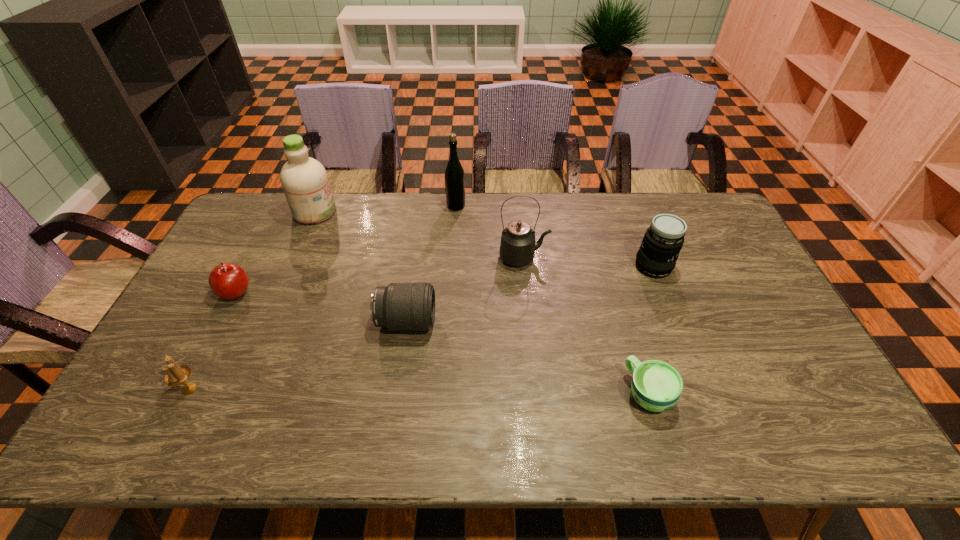
Find the location of a particular element. Image resolution: width=960 pixels, height=540 pixels. vacant point located between the second object from right to left and the apple is located at coordinates (442, 343).

This screenshot has width=960, height=540. Find the location of `object that stands as the fourth closest to the seventh object from left to right`. object that stands as the fourth closest to the seventh object from left to right is located at coordinates (454, 176).

Find the location of a particular element. object that can be found as the sixth closest to the third object from right to left is located at coordinates (227, 281).

The image size is (960, 540). I want to click on blank space that satisfies the following two spatial constraints: 1. on the surface of the cup; 2. on the left side of the fifth object from right to left, so click(x=396, y=393).

Locate an element on the screen. The width and height of the screenshot is (960, 540). vacant space that satisfies the following two spatial constraints: 1. on the back side of the seventh object from left to right; 2. on the surface of the shorter telephoto lens is located at coordinates (627, 322).

You are a GUI agent. You are given a task and a screenshot of the screen. Output one action in this format:
    pyautogui.click(x=<x>, y=<y>)
    Task: Click on the vacant space that satisfies the following two spatial constraints: 1. on the back side of the taller telephoto lens; 2. spout on the third object from right to left
    Image resolution: width=960 pixels, height=540 pixels.
    Given the screenshot: What is the action you would take?
    pyautogui.click(x=650, y=258)

Locate an element on the screen. blank space that satisfies the following two spatial constraints: 1. spout on the seventh object from left to right; 2. on the left side of the kettle is located at coordinates (537, 393).

Identify the location of vacant area that satisfies the following two spatial constraints: 1. on the back side of the second object from right to left; 2. on the surface of the fifth object from right to left. This screenshot has width=960, height=540. (627, 322).

Where is `free space that satisfies the following two spatial constraints: 1. on the back side of the apple; 2. on the right side of the fourth object from right to left`? free space that satisfies the following two spatial constraints: 1. on the back side of the apple; 2. on the right side of the fourth object from right to left is located at coordinates (280, 206).